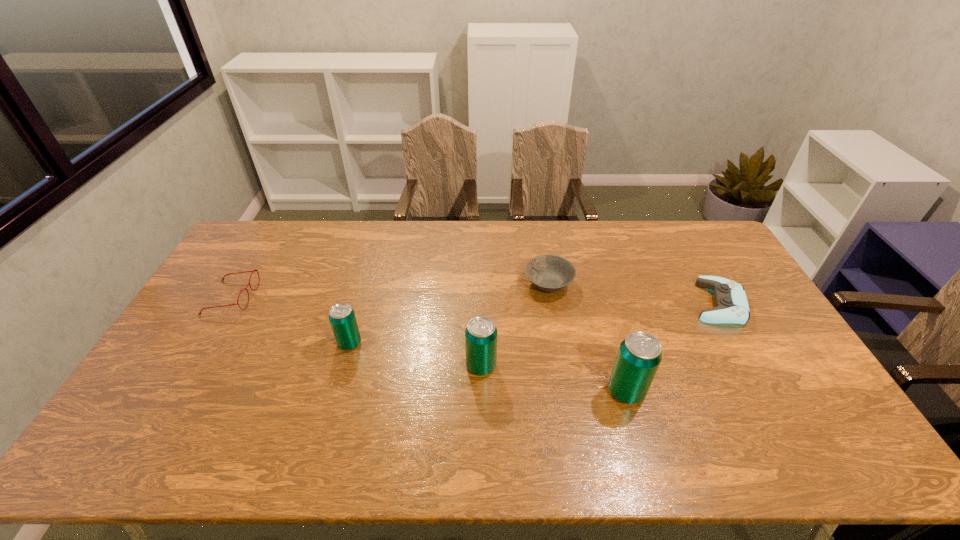
At what (x,y) coordinates should I click in order to perform the action: click on vacant space located 0.150m on the back of the rightmost beer can. Please return your answer as a coordinate pair (x, y). Looking at the image, I should click on (610, 334).

Where is `vacant region located 0.120m on the face of the spectacles`? The width and height of the screenshot is (960, 540). vacant region located 0.120m on the face of the spectacles is located at coordinates (290, 297).

What are the coordinates of `blank space located 0.300m on the right of the bowl` in the screenshot? It's located at (662, 284).

Locate an element on the screen. The width and height of the screenshot is (960, 540). free spot located 0.100m on the back of the control is located at coordinates (695, 263).

Locate an element on the screen. object at the near edge is located at coordinates (639, 355).

Identify the location of object at the left edge. (252, 271).

Locate an element on the screen. object at the right edge is located at coordinates (731, 302).

The width and height of the screenshot is (960, 540). In order to click on free space at the far edge in this screenshot , I will do `click(433, 259)`.

The height and width of the screenshot is (540, 960). In order to click on vacant space at the near edge of the desktop in this screenshot , I will do `click(612, 420)`.

Image resolution: width=960 pixels, height=540 pixels. Find the location of `vacant space at the left edge`. vacant space at the left edge is located at coordinates (244, 277).